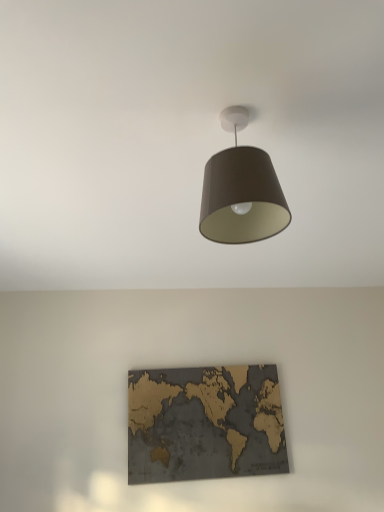
What do you see at coordinates (205, 423) in the screenshot? The image size is (384, 512). I see `gold textured map at center` at bounding box center [205, 423].

This screenshot has height=512, width=384. Find the location of `gold textured map at center`. gold textured map at center is located at coordinates (205, 423).

Image resolution: width=384 pixels, height=512 pixels. What do you see at coordinates (241, 191) in the screenshot? I see `matte brown lampshade at upper center` at bounding box center [241, 191].

Locate an element on the screen. This screenshot has height=512, width=384. matte brown lampshade at upper center is located at coordinates (241, 191).

At what (x,y) coordinates should I click in order to perform the action: click on gold textured map at center. Please return your answer as a coordinate pair (x, y). The width and height of the screenshot is (384, 512). Looking at the image, I should click on (205, 423).

Which is more to the left, gold textured map at center or matte brown lampshade at upper center?

From the viewer's perspective, gold textured map at center appears more on the left side.

Is gold textured map at center in front of matte brown lampshade at upper center?

No, gold textured map at center is further to the viewer.

Which is behind, point (168, 454) or point (211, 159)?

Positioned behind is point (168, 454).

In the scene shown: From the image's perspective, is gold textured map at center positioned above or below matte brown lampshade at upper center?

gold textured map at center is below matte brown lampshade at upper center.

From a real-world perspective, between gold textured map at center and matte brown lampshade at upper center, who is vertically lower?

In real-world perspective, gold textured map at center is lower.

Does gold textured map at center have a greater width compared to matte brown lampshade at upper center?

In fact, gold textured map at center might be narrower than matte brown lampshade at upper center.

Which of these two, gold textured map at center or matte brown lampshade at upper center, stands shorter?

Standing shorter between the two is matte brown lampshade at upper center.

Considering the sizes of objects gold textured map at center and matte brown lampshade at upper center in the image provided, who is bigger, gold textured map at center or matte brown lampshade at upper center?

matte brown lampshade at upper center.

Is gold textured map at center outside of matte brown lampshade at upper center?

Absolutely, gold textured map at center is external to matte brown lampshade at upper center.

Can you see gold textured map at center touching matte brown lampshade at upper center?

gold textured map at center and matte brown lampshade at upper center are clearly separated.

Is gold textured map at center facing away from matte brown lampshade at upper center?

gold textured map at center does not have its back to matte brown lampshade at upper center.

Identify the location of lamp above the gold textured map at center (from the image's perspective). pos(241,191).

Which object is positioned more to the right, matte brown lampshade at upper center or gold textured map at center?

From the viewer's perspective, matte brown lampshade at upper center appears more on the right side.

Relative to gold textured map at center, is matte brown lampshade at upper center in front or behind?

In the image, matte brown lampshade at upper center appears in front of gold textured map at center.

Which is behind, point (281, 222) or point (238, 406)?

The point (238, 406) is behind.

From the image's perspective, does matte brown lampshade at upper center appear higher than gold textured map at center?

Correct, matte brown lampshade at upper center appears higher than gold textured map at center in the image.

From a real-world perspective, is matte brown lampshade at upper center physically below gold textured map at center?

No, from a real-world perspective, matte brown lampshade at upper center is not below gold textured map at center.

Based on the photo, which object is thinner, matte brown lampshade at upper center or gold textured map at center?

gold textured map at center is thinner.

Between matte brown lampshade at upper center and gold textured map at center, which one has less height?

matte brown lampshade at upper center.

Who is bigger, matte brown lampshade at upper center or gold textured map at center?

With larger size is matte brown lampshade at upper center.

Is matte brown lampshade at upper center not within gold textured map at center?

Yes, matte brown lampshade at upper center is outside of gold textured map at center.

Can you see matte brown lampshade at upper center touching gold textured map at center?

No, matte brown lampshade at upper center is not in contact with gold textured map at center.

Is matte brown lampshade at upper center turned away from gold textured map at center?

No, gold textured map at center is not at the back of matte brown lampshade at upper center.

What's the angular difference between matte brown lampshade at upper center and gold textured map at center's facing directions?

The facing directions of matte brown lampshade at upper center and gold textured map at center are 92 degrees apart.

How distant is matte brown lampshade at upper center from gold textured map at center?

matte brown lampshade at upper center is 1.59 meters away from gold textured map at center.

The width and height of the screenshot is (384, 512). I want to click on picture frame below the matte brown lampshade at upper center (from a real-world perspective), so 205,423.

What are the coordinates of `picture frame located underneath the matte brown lampshade at upper center (from a real-world perspective)` in the screenshot? It's located at (205, 423).

What are the coordinates of `picture frame that appears on the left of matte brown lampshade at upper center` in the screenshot? It's located at (205, 423).